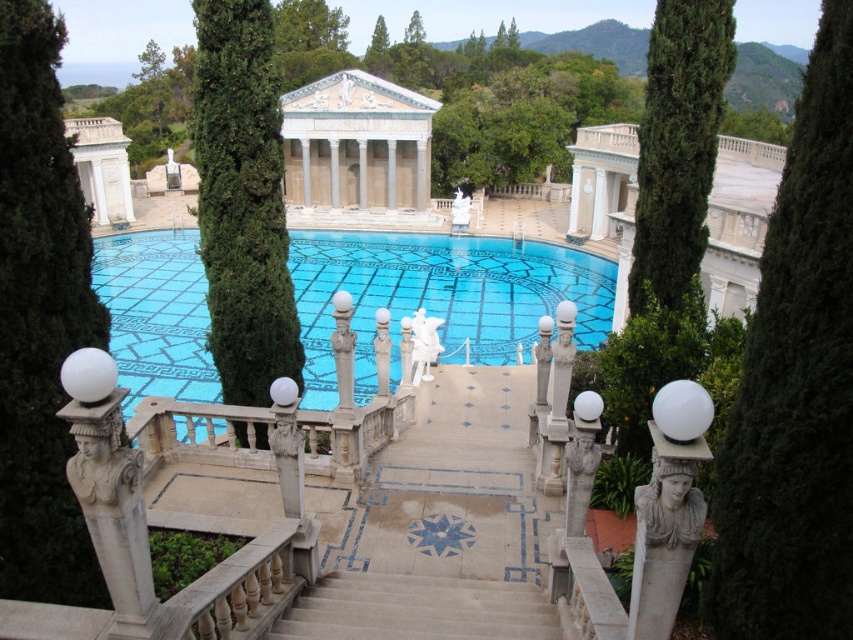
You are standing at the bottom of the staircase leading to the pool and notice the green coniferous tree at upper center and the white marble temple at center. Which object is higher in elevation compared to the other?

The green coniferous tree at upper center is much taller than the white marble temple at center, so it is higher in elevation.

You are standing at the bottom of the staircase in the grand estate scene. You notice two trees in the background. The green leafy tree at left and the green textured tree at center. Which tree is closer to you?

The green leafy tree at left is closer to you since it is positioned in front of the green textured tree at center.

You are an architect analyzing the elevation of the scene. Which object between the blue mosaic tiles at center and the white marble temple at center is taller?

The blue mosaic tiles at center is taller than the white marble temple at center according to the description.